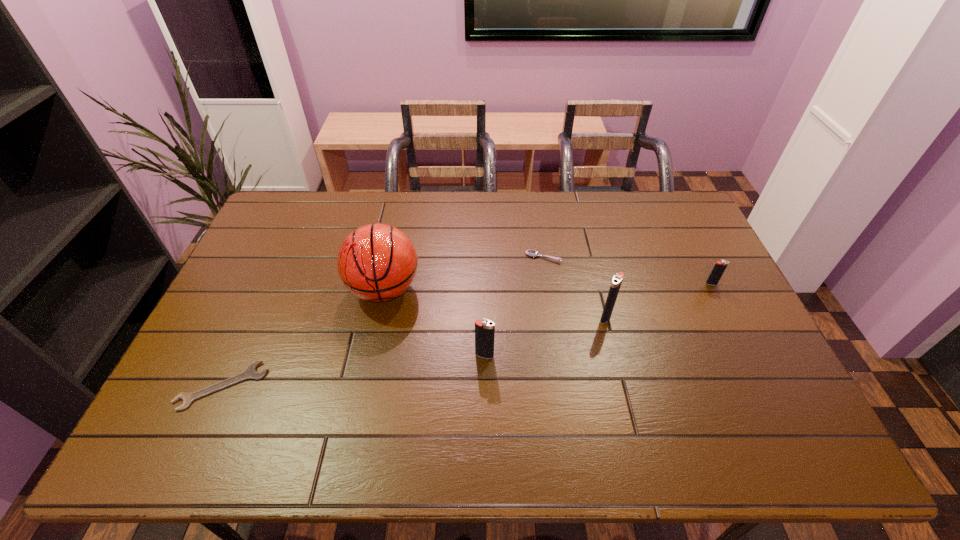
Identify the location of the leftmost igniter. Image resolution: width=960 pixels, height=540 pixels. (484, 330).

This screenshot has height=540, width=960. What are the coordinates of `the third object from left to right` in the screenshot? It's located at (484, 330).

Locate an element on the screen. the second object from right to left is located at coordinates (616, 283).

I want to click on the second igniter from right to left, so click(x=616, y=283).

At what (x,y) coordinates should I click in order to perform the action: click on the shortest igniter. Please return your answer as a coordinate pair (x, y). The image size is (960, 540). Looking at the image, I should click on (720, 266).

In order to click on the rightmost object in this screenshot , I will do `click(720, 266)`.

Locate an element on the screen. the farthest object is located at coordinates (530, 252).

This screenshot has width=960, height=540. In order to click on the second shortest object in this screenshot , I will do `click(530, 252)`.

The width and height of the screenshot is (960, 540). What are the coordinates of `basketball` in the screenshot? It's located at (377, 262).

Where is `the tallest object`? Image resolution: width=960 pixels, height=540 pixels. the tallest object is located at coordinates (377, 262).